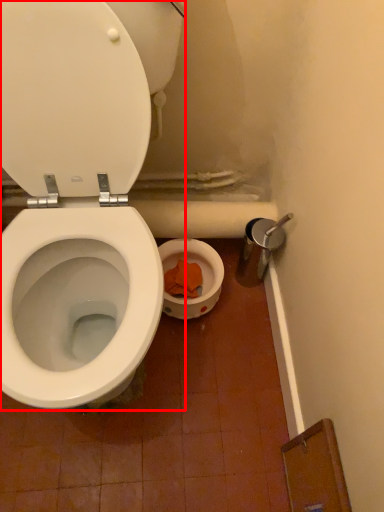
Question: Where is toilet (annotated by the red box) located in relation to lid in the image?

Choices:
 (A) right
 (B) left

Answer: (B)